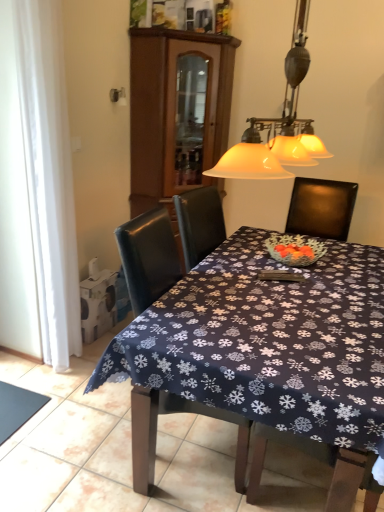
The image size is (384, 512). In order to click on vacant space underneath dark blue fabric at lower left (from a real-world perspective) in this screenshot , I will do `click(16, 406)`.